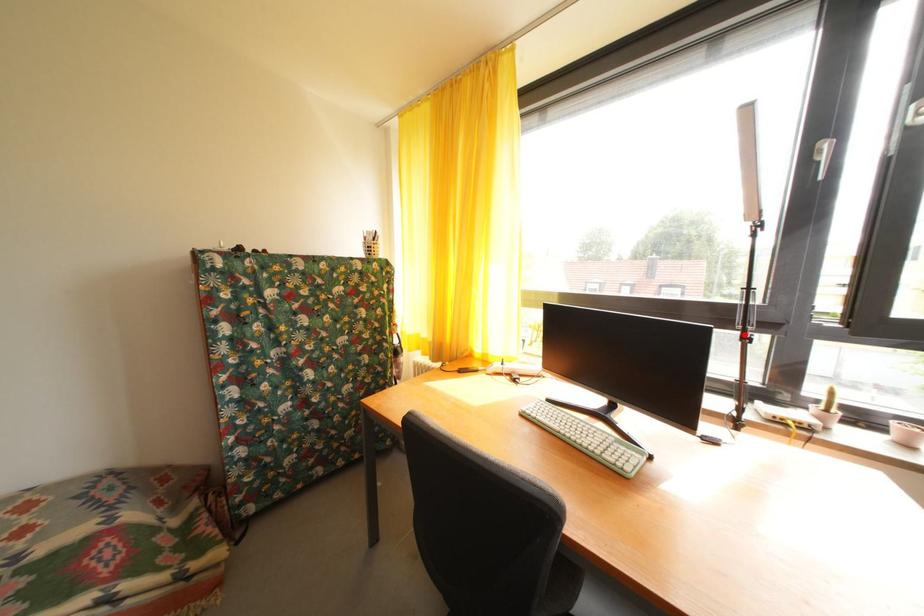
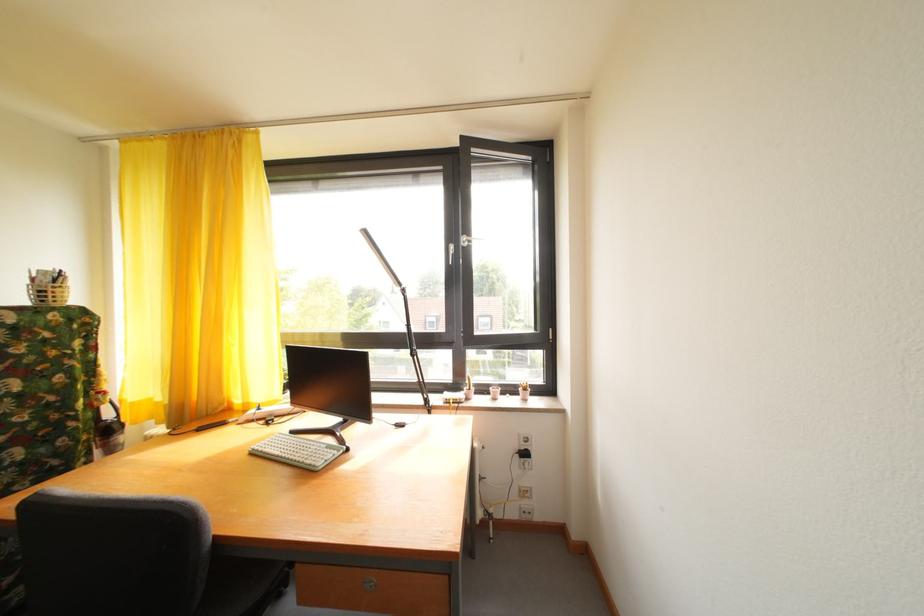
Locate, in the second image, the point that corresponds to the highlighted location in the first image.

(416, 355)